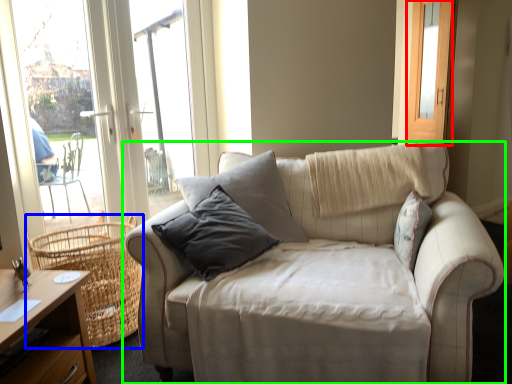
Question: Estimate the real-world distances between objects in this image. Which object is closer to screen door (highlighted by a red box), basket (highlighted by a blue box) or studio couch (highlighted by a green box)?

Choices:
 (A) basket
 (B) studio couch

Answer: (B)